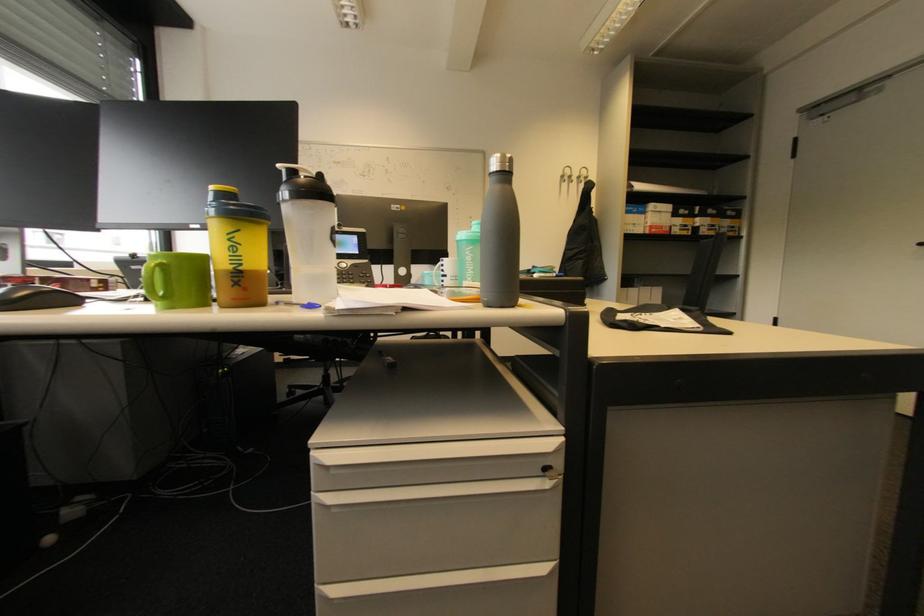
This screenshot has width=924, height=616. What do you see at coordinates (155, 280) in the screenshot?
I see `the green mug handle` at bounding box center [155, 280].